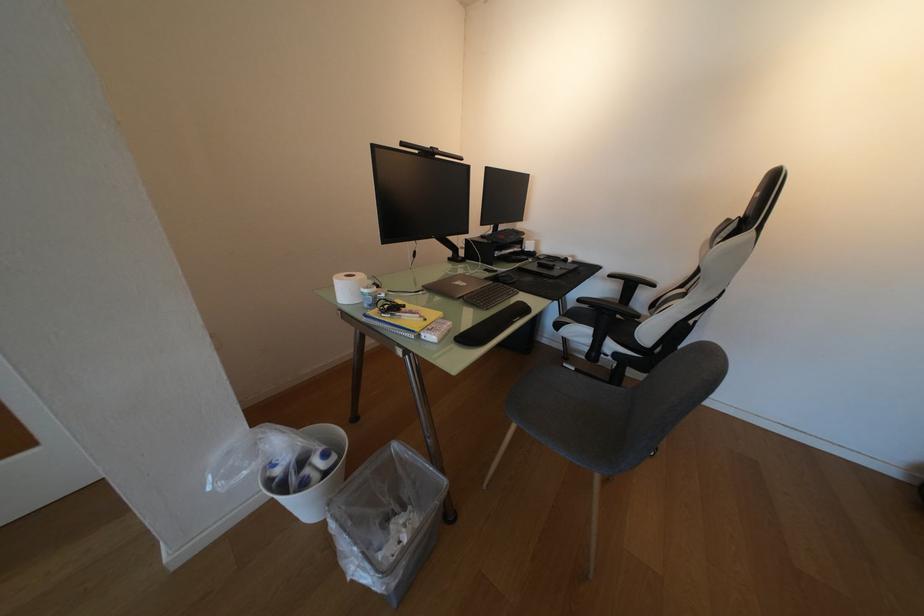
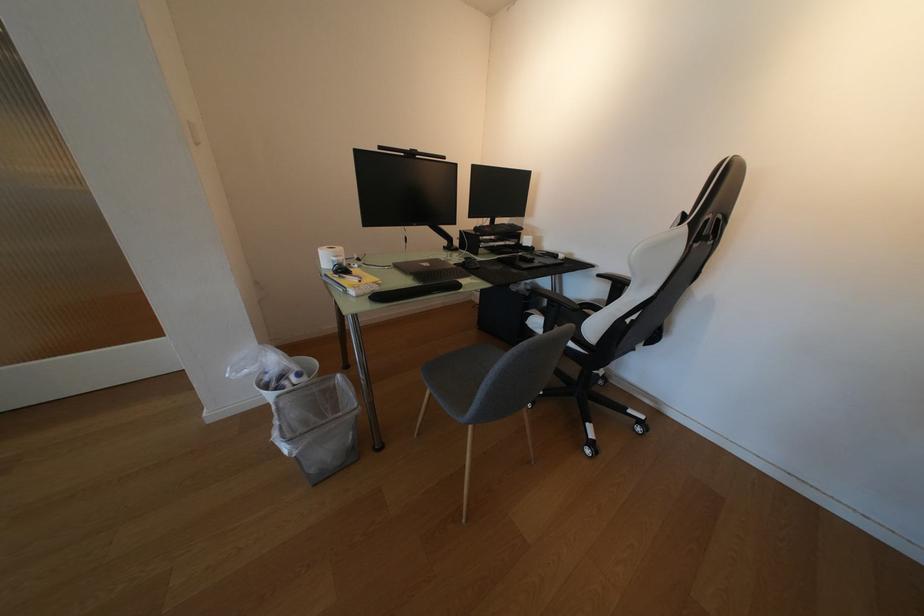
Find the pixel in the second image that matches pixel 432 294 in the first image.

(397, 268)